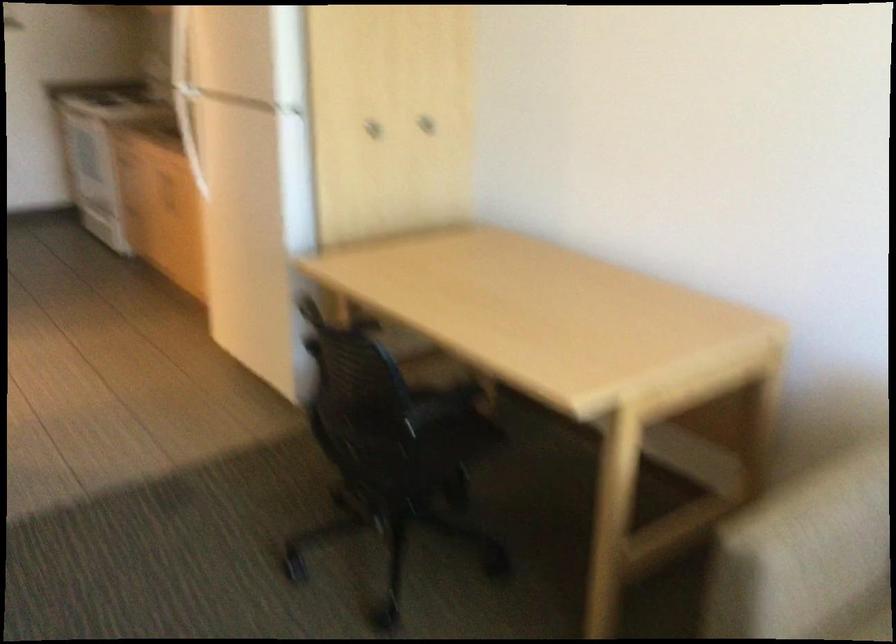
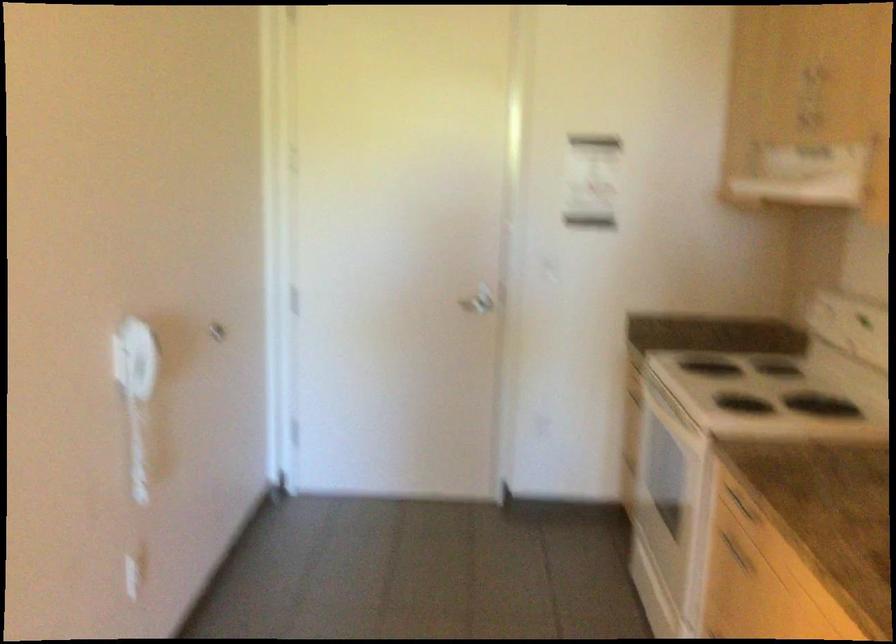
Find the pixel in the second image that matches pixel 145 165 in the first image.

(735, 552)